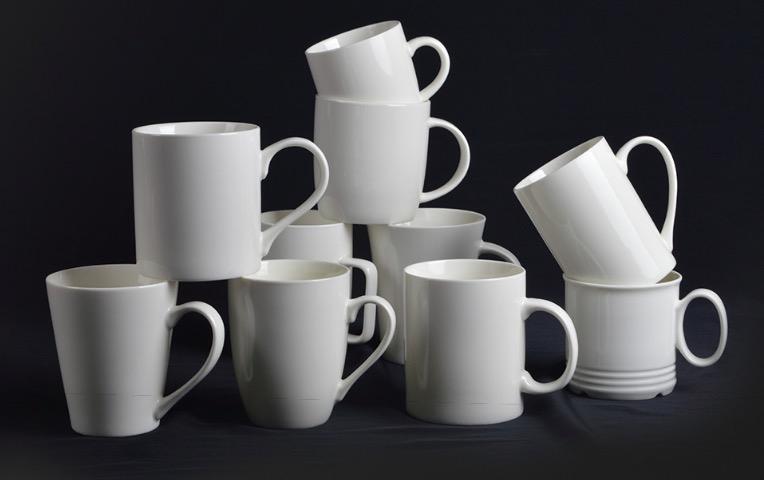
What are the coordinates of `coffee mugs` in the screenshot? It's located at (128, 346), (299, 333), (173, 223), (329, 232), (395, 169), (371, 61), (447, 234), (483, 350), (636, 349), (619, 218).